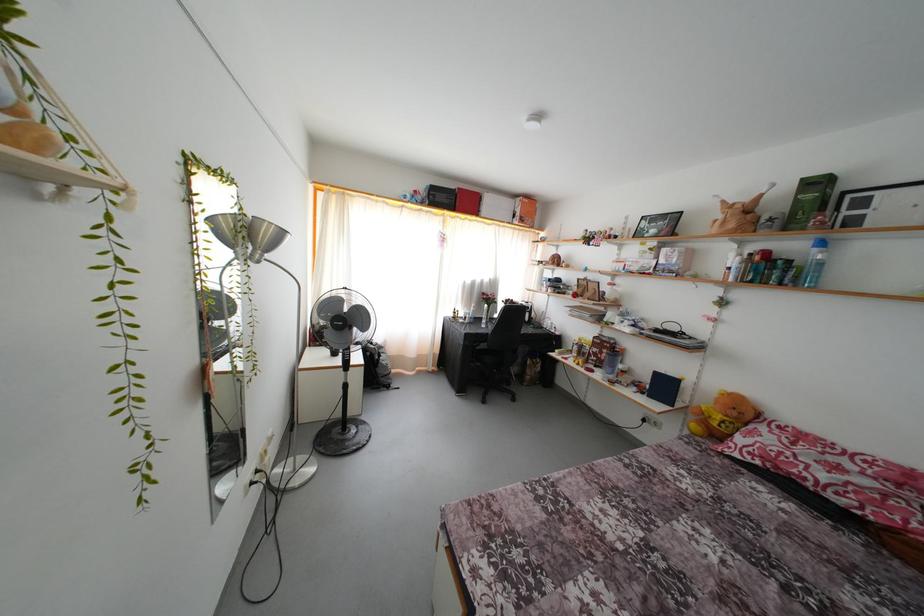
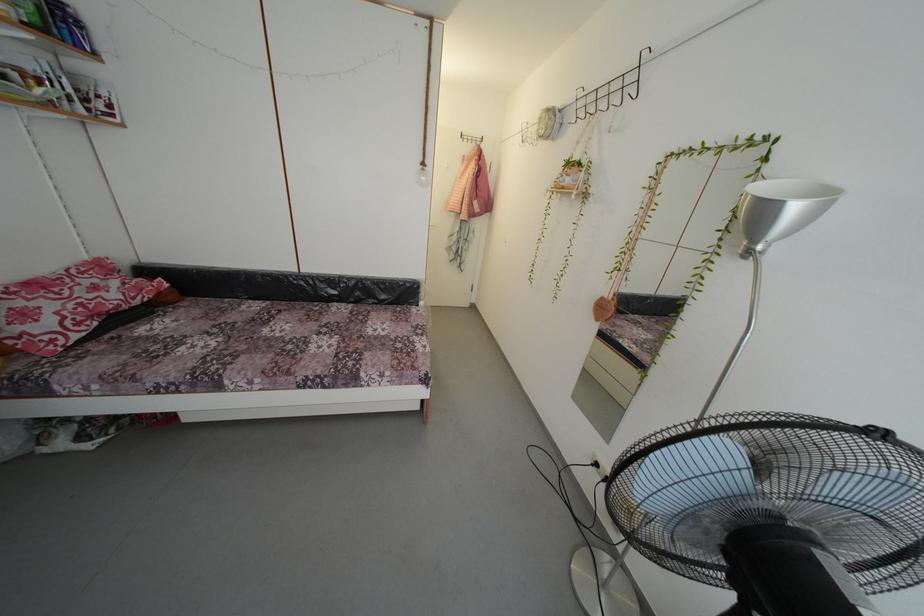
Where in the second image is the point corresponding to the point at 775,438 from the first image?

(34, 306)